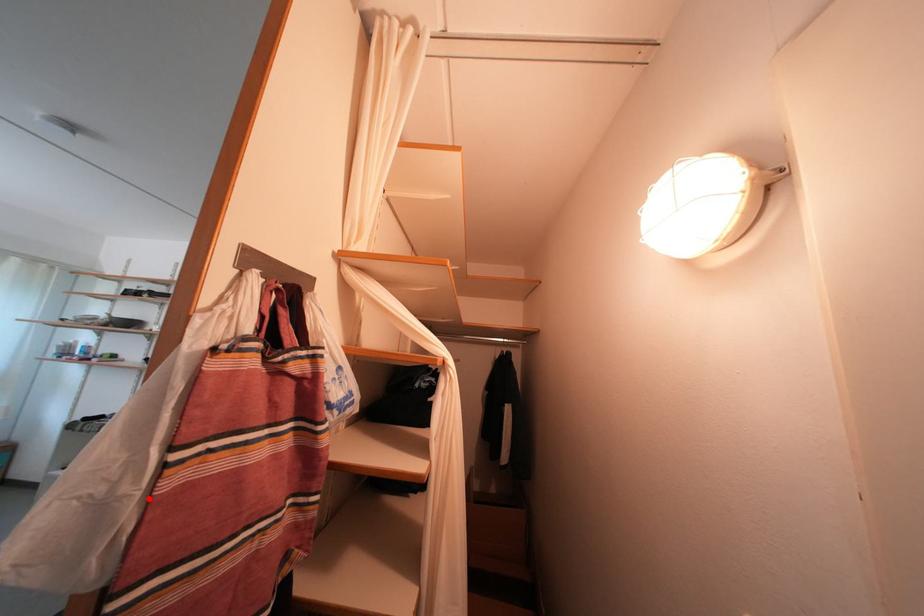
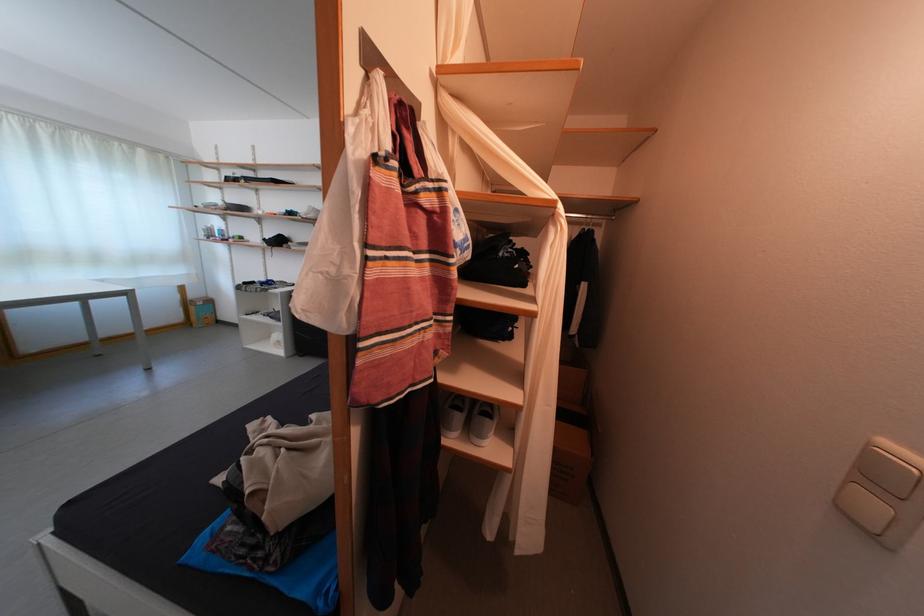
Find the pixel in the second image that matches the highlighted location in the first image.

(366, 282)